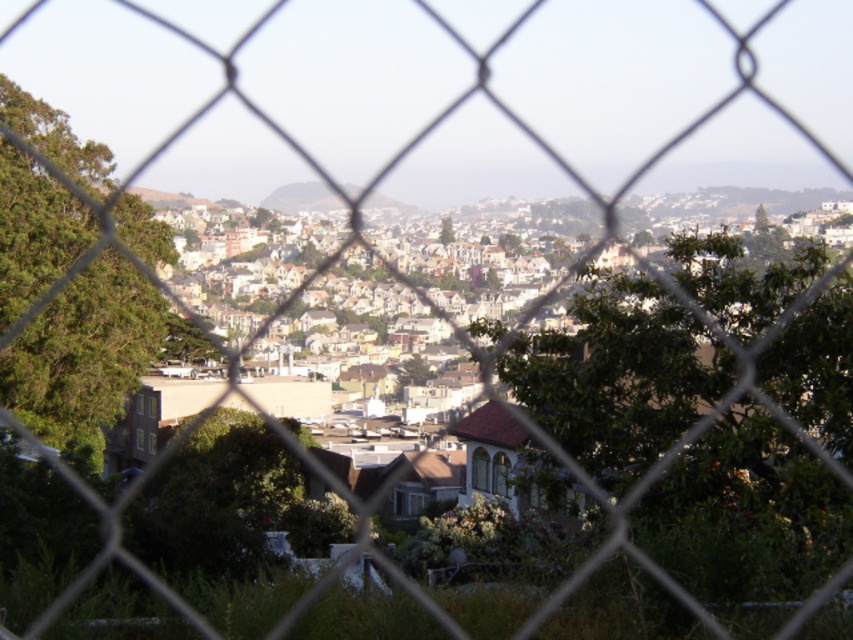
Which is below, green leafy tree at left or green grassy hillside at center?

green leafy tree at left

Does green leafy tree at left appear on the right side of green grassy hillside at center?

Incorrect, green leafy tree at left is not on the right side of green grassy hillside at center.

Measure the distance between green leafy tree at left and camera.

green leafy tree at left and camera are 171.90 meters apart from each other.

Locate an element on the screen. This screenshot has height=640, width=853. green leafy tree at left is located at coordinates (84, 353).

Can you confirm if green leafy tree at center is smaller than green grassy hillside at center?

Incorrect, green leafy tree at center is not smaller in size than green grassy hillside at center.

From the picture: Is green leafy tree at center wider than green grassy hillside at center?

Incorrect, green leafy tree at center's width does not surpass green grassy hillside at center's.

Is point (779, 296) behind point (305, 200)?

That is False.

Locate an element on the screen. This screenshot has height=640, width=853. green leafy tree at center is located at coordinates (619, 376).

Can you confirm if green leafy tree at left is taller than green matte tree at center?

Correct, green leafy tree at left is much taller as green matte tree at center.

Does green leafy tree at left have a lesser height compared to green matte tree at center?

No, green leafy tree at left is not shorter than green matte tree at center.

Between point (44, 122) and point (445, 224), which one is positioned behind?

The point (445, 224) is behind.

This screenshot has width=853, height=640. Identify the location of green leafy tree at left. coord(84,353).